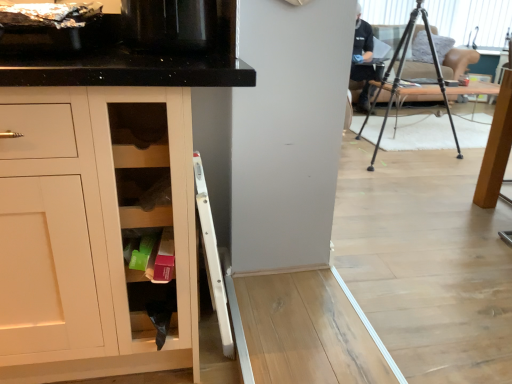
Question: Does point (498, 148) appear closer or farther from the camera than point (159, 6)?

Choices:
 (A) farther
 (B) closer

Answer: (A)

Question: From the image's perspective, is light brown wooden table at right located above or below black glossy microwave at upper left?

Choices:
 (A) above
 (B) below

Answer: (B)

Question: Which is farther from the black glossy microwave at upper left?

Choices:
 (A) light brown wooden table at right
 (B) wooden shelves at lower center

Answer: (A)

Question: Which of these objects is positioned closest to the light brown wooden table at right?

Choices:
 (A) black glossy microwave at upper left
 (B) wooden shelves at lower center

Answer: (A)